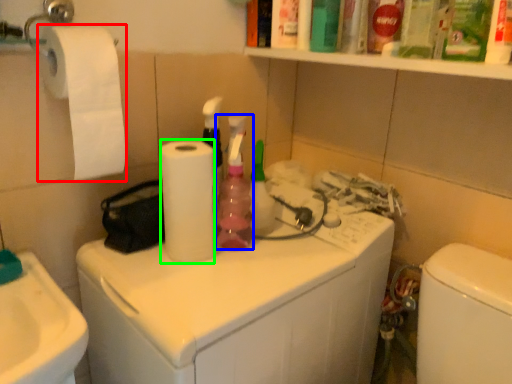
Question: Based on their relative distances, which object is farther from toilet paper (highlighted by a red box)? Choose from cleaning product (highlighted by a blue box) and paper towel (highlighted by a green box).

Choices:
 (A) cleaning product
 (B) paper towel

Answer: (A)